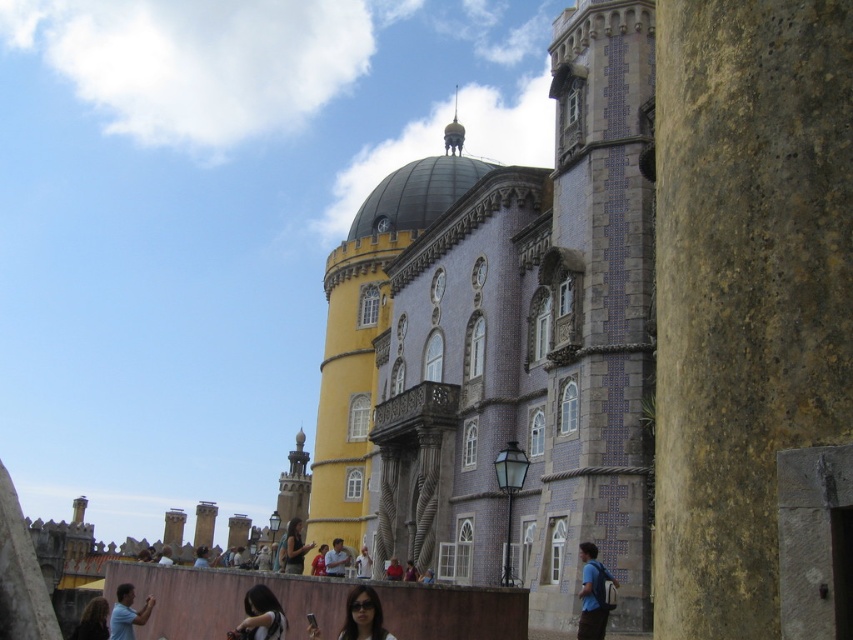
Question: Can you confirm if dark brown hair at lower left is thinner than matte red shirt at center?

Choices:
 (A) no
 (B) yes

Answer: (A)

Question: Which is farther from the blue fabric backpack at lower right?

Choices:
 (A) matte red shirt at center
 (B) yellow painted stone tower at center

Answer: (B)

Question: Is matte black dress at center in front of matte red shirt at center?

Choices:
 (A) yes
 (B) no

Answer: (A)

Question: Can you confirm if light blue shirt at lower left is positioned to the right of matte black dress at center?

Choices:
 (A) yes
 (B) no

Answer: (A)

Question: Which point is farther from the camera taking this photo?

Choices:
 (A) (410, 580)
 (B) (422, 577)
 (C) (358, 212)
 (D) (328, 548)

Answer: (C)

Question: Which object is the farthest from the light brown leather jacket at lower center?

Choices:
 (A) smooth black hair at lower center
 (B) dark brown hair at lower left
 (C) yellow painted stone tower at center

Answer: (A)